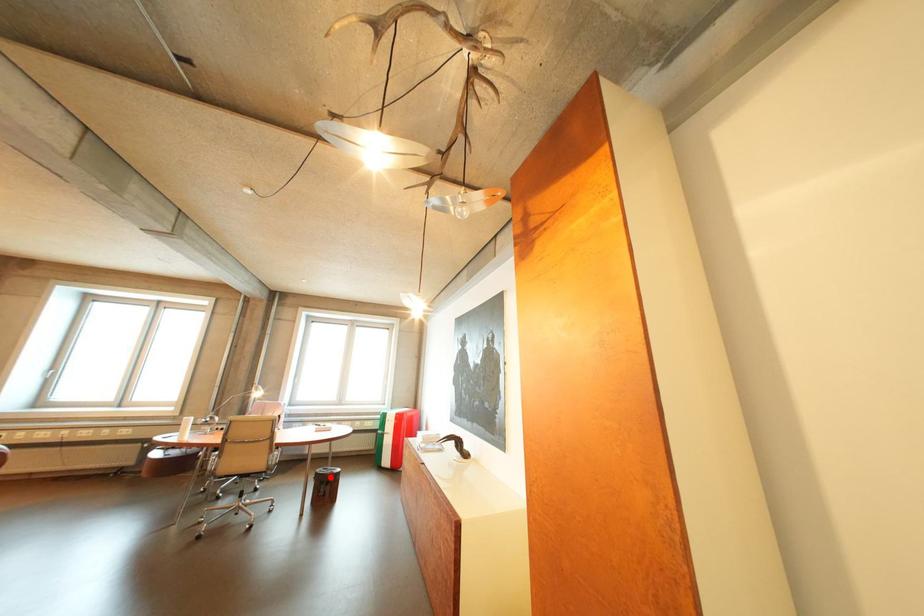
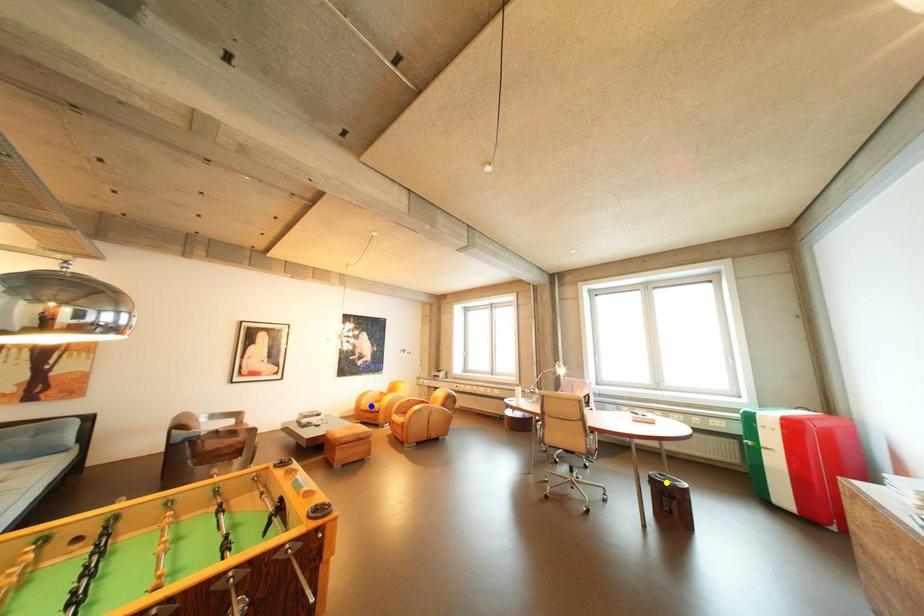
Question: I am providing you with two images of the same scene from different viewpoints. A red point is marked on the first image. You are given multiple points on the second image. Which mark in image 2 goes with the point in image 1?

Choices:
 (A) blue point
 (B) yellow point
 (C) green point

Answer: (B)